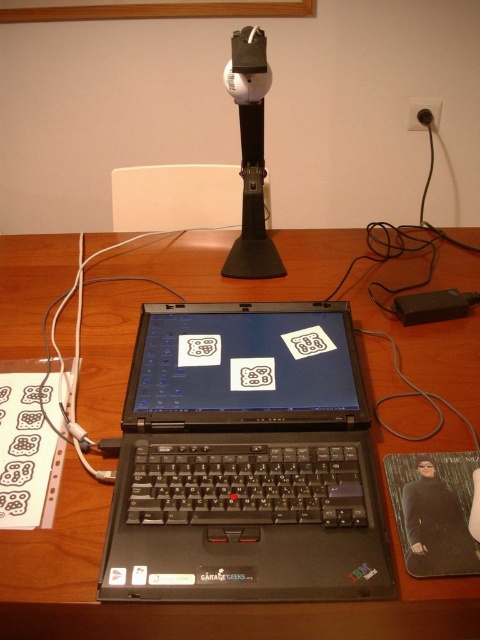
You are setting up a new workspace and need to place a laptop and some stickers. The wooden table at center is your main surface. Where exactly on the table should you position the laptop and the stickers to match the image?

The wooden table at center is located at point (x=213, y=604), so position the laptop and stickers accordingly to align with the coordinates provided.

You are organizing your desk and need to place a new item between the wooden table at center and the black plastic laptop at center. Is this possible?

The wooden table at center is located above the black plastic laptop at center, meaning there is no space between them for placing an item.